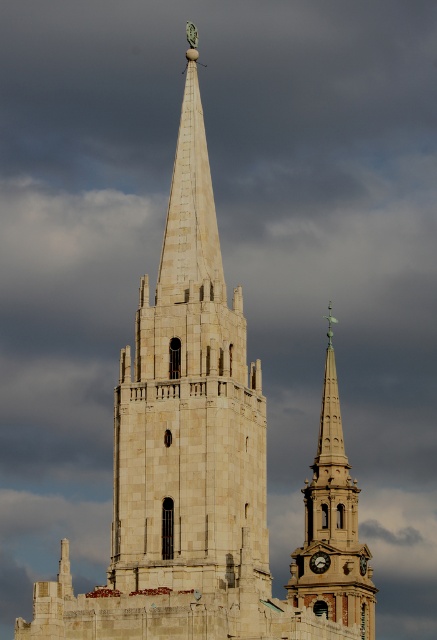
Does white stone steeple at center appear on the left side of gold metallic clock at center?

Correct, you'll find white stone steeple at center to the left of gold metallic clock at center.

Is white stone steeple at center positioned at the back of gold metallic clock at center?

No, white stone steeple at center is in front of gold metallic clock at center.

Is point (155, 492) positioned behind point (322, 564)?

No, it is in front of (322, 564).

Locate an element on the screen. white stone steeple at center is located at coordinates (188, 403).

Can you confirm if smooth stone spire at center is smaller than gold metallic clock at center?

Incorrect, smooth stone spire at center is not smaller in size than gold metallic clock at center.

Which is above, smooth stone spire at center or gold metallic clock at center?

smooth stone spire at center is above.

Who is more forward, (315, 518) or (311, 566)?

Point (311, 566) is in front.

Identify the location of smooth stone spire at center. The image size is (437, 640). (332, 524).

Describe the element at coordinates (188, 403) in the screenshot. I see `white stone steeple at center` at that location.

In the scene shown: Is white stone steeple at center to the left of smooth stone spire at center from the viewer's perspective?

Indeed, white stone steeple at center is positioned on the left side of smooth stone spire at center.

What do you see at coordinates (188, 403) in the screenshot? Image resolution: width=437 pixels, height=640 pixels. I see `white stone steeple at center` at bounding box center [188, 403].

The height and width of the screenshot is (640, 437). In order to click on white stone steeple at center in this screenshot , I will do `click(188, 403)`.